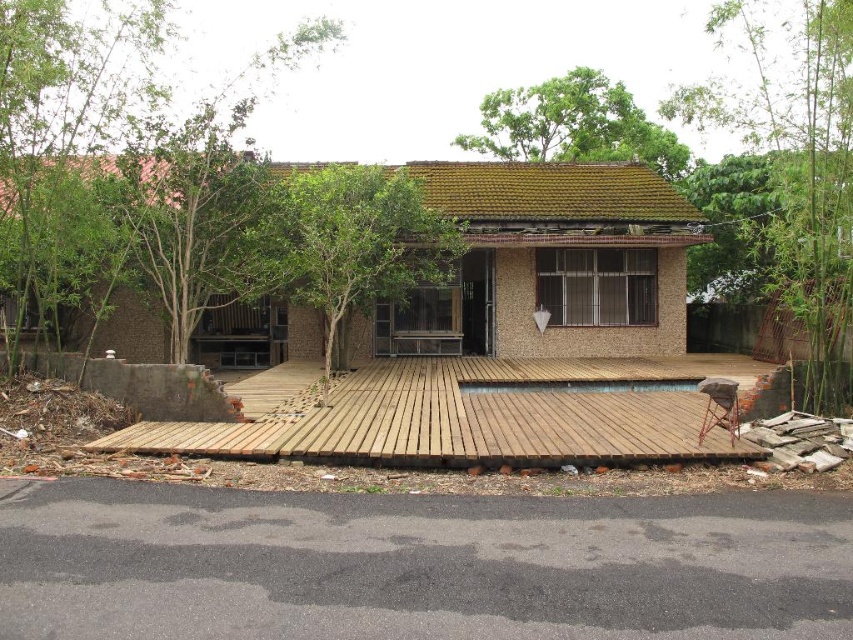
Question: Estimate the real-world distances between objects in this image. Which object is farther from the green leafy tree at center?

Choices:
 (A) green leafy tree at upper center
 (B) green leafy tree at left
 (C) wooden deck at center

Answer: (A)

Question: Can you confirm if green bamboo at right is thinner than green leafy tree at center?

Choices:
 (A) no
 (B) yes

Answer: (A)

Question: Which point appears farthest from the camera in this image?

Choices:
 (A) (521, 148)
 (B) (155, 186)
 (C) (294, 225)
 (D) (695, 116)

Answer: (A)

Question: Does wooden deck at center have a larger size compared to green leafy tree at center?

Choices:
 (A) no
 (B) yes

Answer: (B)

Question: Among these points, which one is nearest to the camera?

Choices:
 (A) pyautogui.click(x=201, y=240)
 (B) pyautogui.click(x=750, y=4)

Answer: (B)

Question: Is green leafy tree at left above green leafy tree at upper center?

Choices:
 (A) no
 (B) yes

Answer: (A)